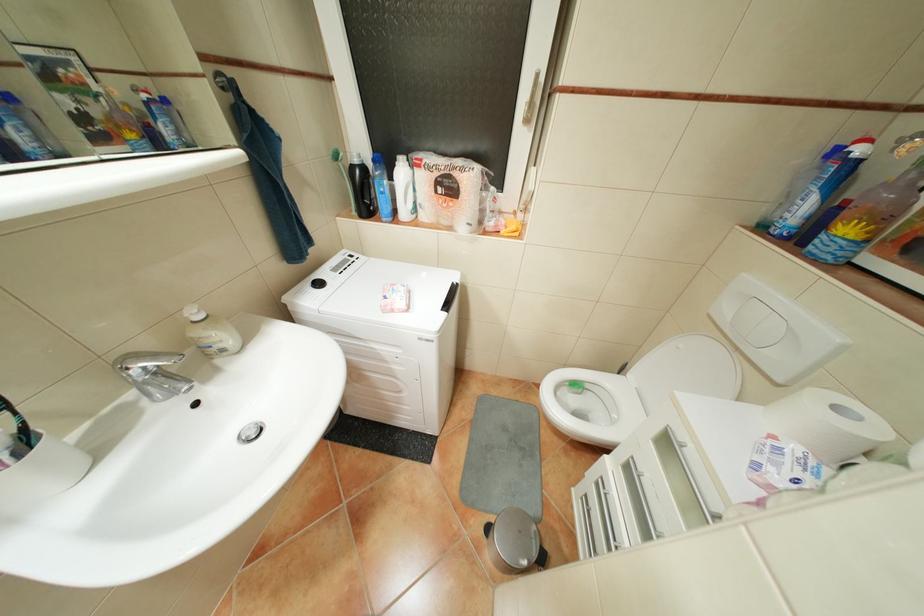
Where would you turn the window handle? Please return your answer as a coordinate pair (x, y).

(532, 102)